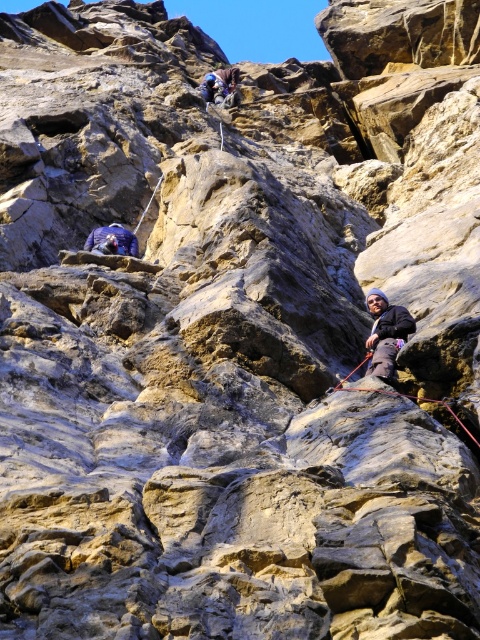
You are a climber looking at the cliff. You see the dark blue fabric at right and the blue fabric jacket at upper center. Which one is lower in position?

The dark blue fabric at right is located below the blue fabric jacket at upper center, so the dark blue fabric at right is lower.

You are a climber assessing the rock face. You see the dark blue fabric at right and the blue fabric jacket at upper center. Which object is closer to the top of the cliff?

The blue fabric jacket at upper center is closer to the top of the cliff because it is positioned higher than the dark blue fabric at right.

You are a climber assessing the available gear on the cliff. You see a dark blue fabric at right and a blue fabric jacket at upper center. Which of these items is narrower in width?

The dark blue fabric at right has a lesser width compared to the blue fabric jacket at upper center, so the dark blue fabric at right is narrower.